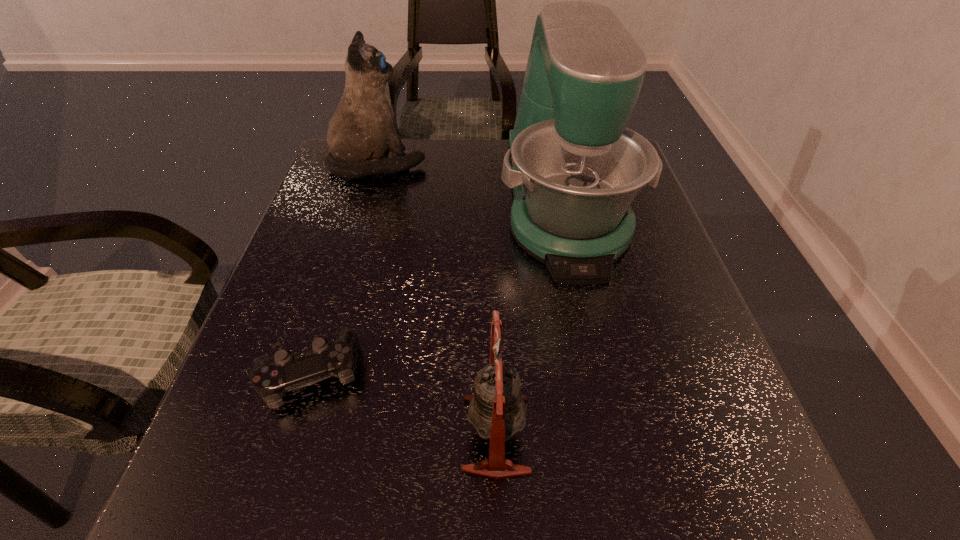
Find the location of a particular element. Image resolution: width=960 pixels, height=540 pixels. vacant space at the near right corner of the desktop is located at coordinates (678, 493).

Find the location of a particular element. Image resolution: width=960 pixels, height=540 pixels. free area in between the cat and the mixer is located at coordinates (470, 182).

You are a GUI agent. You are given a task and a screenshot of the screen. Output one action in this format:
    pyautogui.click(x=<x>, y=<y>)
    Task: Click on the free spot between the cat and the control
    
    Given the screenshot: What is the action you would take?
    pyautogui.click(x=343, y=268)

At what (x,y) coordinates should I click in order to perform the action: click on empty location between the bell and the third shortest object. Please return your answer as a coordinate pair (x, y). Looking at the image, I should click on (437, 299).

I want to click on vacant space that's between the bell and the shortest object, so 402,403.

I want to click on vacant space in between the third tallest object and the cat, so (x=437, y=299).

You are a GUI agent. You are given a task and a screenshot of the screen. Output one action in this format:
    pyautogui.click(x=<x>, y=<y>)
    Task: Click on the vacant area between the third shortest object and the control
    
    Given the screenshot: What is the action you would take?
    pyautogui.click(x=343, y=268)

I want to click on unoccupied position between the control and the tallest object, so click(436, 287).

Image resolution: width=960 pixels, height=540 pixels. In order to click on free spot between the second shortest object and the cat in this screenshot , I will do `click(437, 299)`.

In order to click on empty space between the cat and the control in this screenshot , I will do `click(343, 268)`.